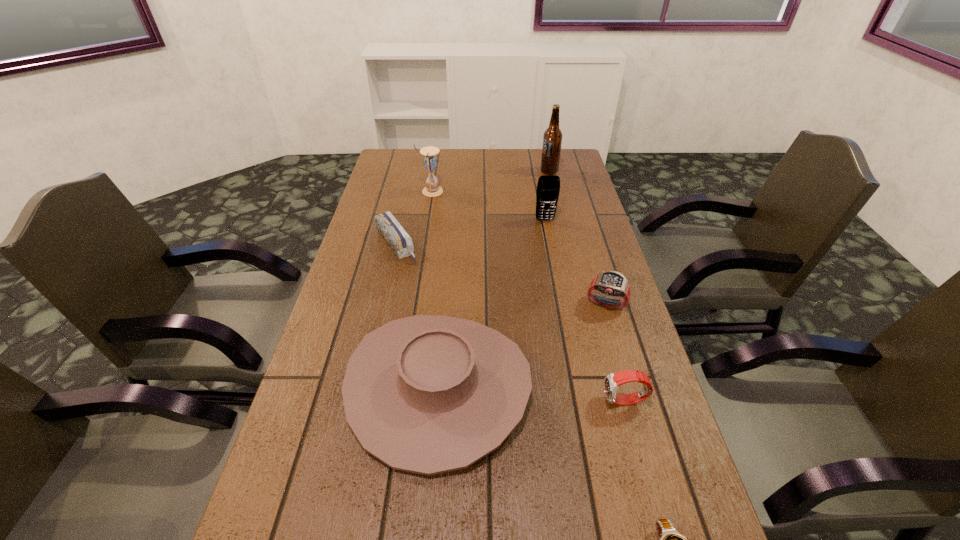
Locate which object ranks in proximity to the nearest watch. Please provide its 2D coordinates. Your answer should be formatted as a tuple, i.e. [(x, y)], where the tuple contains the x and y coordinates of a point satisfying the conditions above.

[(427, 394)]

At what (x,y) coordinates should I click in order to perform the action: click on the second closest watch relative to the cowboy hat. Please return your answer as a coordinate pair (x, y). The width and height of the screenshot is (960, 540). Looking at the image, I should click on (612, 283).

Identify which watch is the closest to the second farthest watch. Please provide its 2D coordinates. Your answer should be formatted as a tuple, i.e. [(x, y)], where the tuple contains the x and y coordinates of a point satisfying the conditions above.

[(669, 539)]

The height and width of the screenshot is (540, 960). I want to click on blank area in the image that satisfies the following two spatial constraints: 1. on the label of the tallest object; 2. on the screen of the cellular telephone, so click(x=561, y=220).

You are a GUI agent. You are given a task and a screenshot of the screen. Output one action in this format:
    pyautogui.click(x=<x>, y=<y>)
    Task: Click on the free spot that satisfies the following two spatial constraints: 1. on the front side of the farthest watch; 2. on the face of the second farthest watch
    This screenshot has height=540, width=960.
    Given the screenshot: What is the action you would take?
    pyautogui.click(x=636, y=401)

Find the location of a particular element. The height and width of the screenshot is (540, 960). vacant space that satisfies the following two spatial constraints: 1. on the label of the beer bottle; 2. on the screen of the cellular telephone is located at coordinates (561, 220).

At what (x,y) coordinates should I click in order to perform the action: click on free space that satisfies the following two spatial constraints: 1. on the front side of the cowboy hat; 2. on the left side of the second shortest object. Please return your answer as a coordinate pair (x, y). The image size is (960, 540). Looking at the image, I should click on click(363, 387).